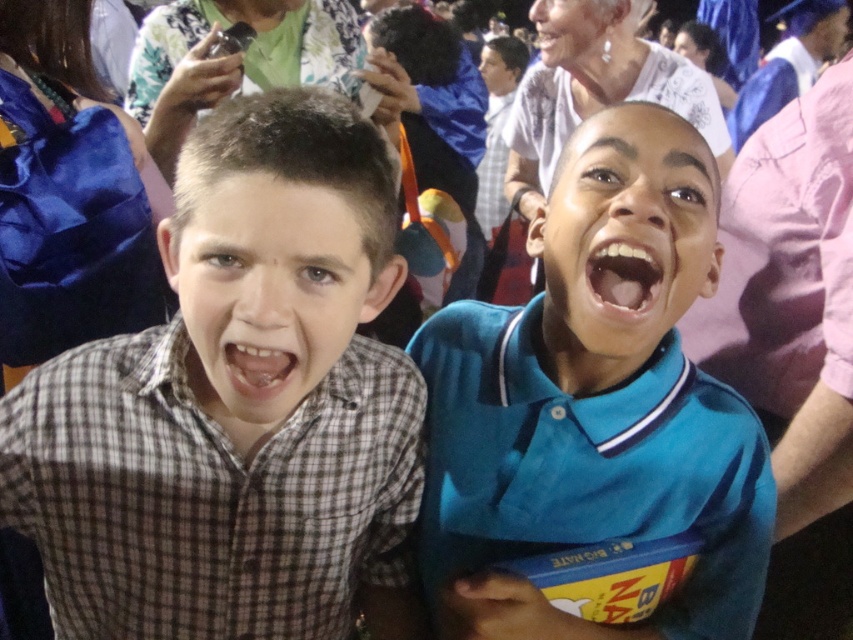
You are a photographer at the event and want to capture both the checkered fabric face at center and the blue matte shirt at center in a single frame. Which object should you focus on first to ensure both are in the frame?

The checkered fabric face at center is not as tall as the blue matte shirt at center, so you should focus on the blue matte shirt at center first to ensure both are in the frame.

You are taking a photo of two boys at a public event. You notice two points in the image at coordinates point (432, 451) and point (576, 323). Which point is closer to your camera?

Point (576, 323) is closer to the camera because it is less further than point (432, 451).

Based on the photo, you are organizing a photo shoot and need to place two shirts, the teal polo shirt at center and the blue matte shirt at center, on a mannequin stand. The stand can only hold items up to 1 meter in width. Based on the image, can both shirts fit on the stand together?

→ The teal polo shirt at center might be wider than blue matte shirt at center, so if the teal polo shirt at center is wider than 0.5 meters, both shirts combined could exceed the stand capacity. However, without exact measurements, it is uncertain if they will fit together.